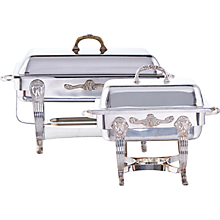
At what (x,y) coordinates should I click in order to perform the action: click on small chafing dish right front leg. Please return your answer as a coordinate pair (x, y). The image size is (220, 220). Looking at the image, I should click on (185, 183).